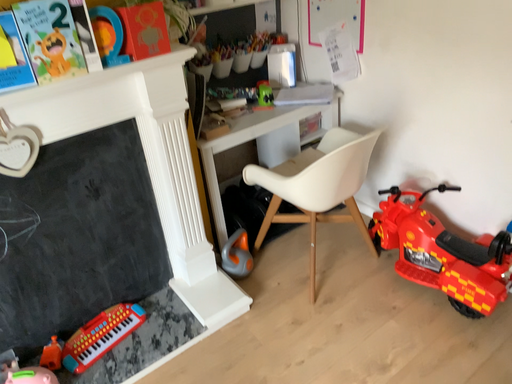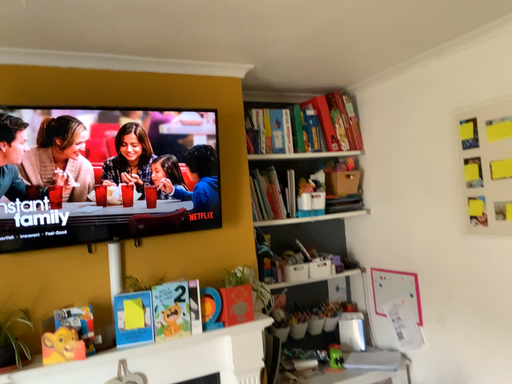
Question: How did the camera likely rotate when shooting the video?

Choices:
 (A) rotated upward
 (B) rotated downward

Answer: (A)